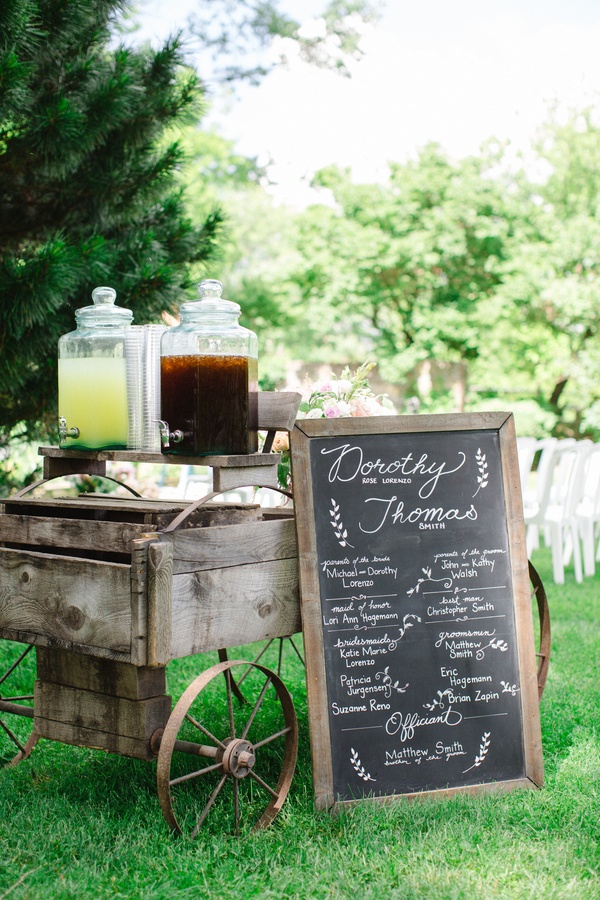
This screenshot has height=900, width=600. Identify the location of suspension bar. (x=213, y=493), (x=41, y=483).